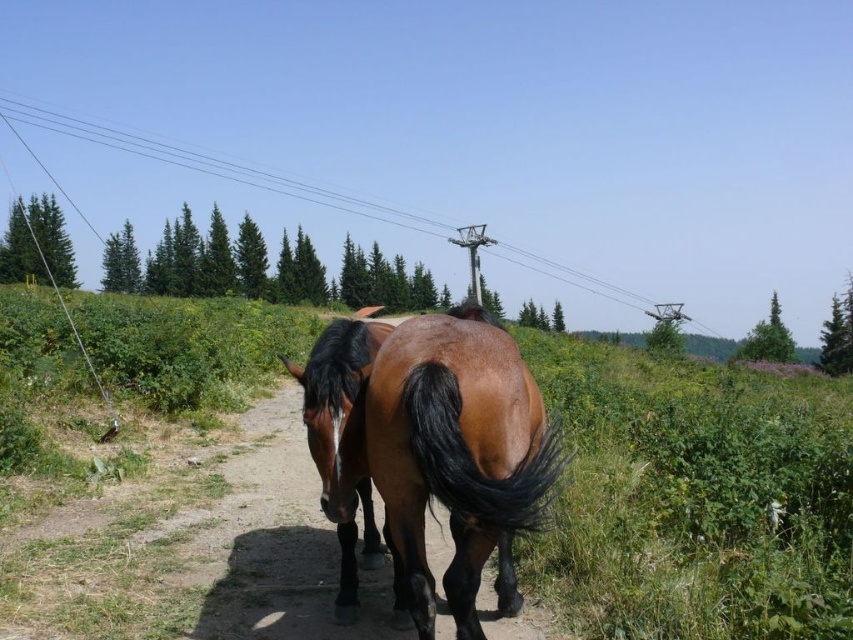
Is point (408, 332) less distant than point (519, 497)?

No.

Does brown glossy horse at center have a lesser width compared to brown glossy tail at center?

No, brown glossy horse at center is not thinner than brown glossy tail at center.

This screenshot has height=640, width=853. I want to click on brown glossy horse at center, so click(x=448, y=452).

The image size is (853, 640). I want to click on brown glossy horse at center, so click(448, 452).

Can you confirm if brown glossy tail at center is thinner than metallic wire at upper center?

Yes, brown glossy tail at center is thinner than metallic wire at upper center.

What do you see at coordinates (474, 458) in the screenshot?
I see `brown glossy tail at center` at bounding box center [474, 458].

Locate an element on the screen. Image resolution: width=853 pixels, height=640 pixels. brown glossy tail at center is located at coordinates (474, 458).

Which is more to the right, brown glossy horse at center or metallic wire at upper center?

From the viewer's perspective, brown glossy horse at center appears more on the right side.

Can you confirm if brown glossy horse at center is smaller than metallic wire at upper center?

Indeed, brown glossy horse at center has a smaller size compared to metallic wire at upper center.

Where is `brown glossy horse at center`? brown glossy horse at center is located at coordinates (448, 452).

You are a GUI agent. You are given a task and a screenshot of the screen. Output one action in this format:
    pyautogui.click(x=<x>, y=<y>)
    Task: Click on the brown glossy horse at center
    
    Given the screenshot: What is the action you would take?
    pyautogui.click(x=448, y=452)